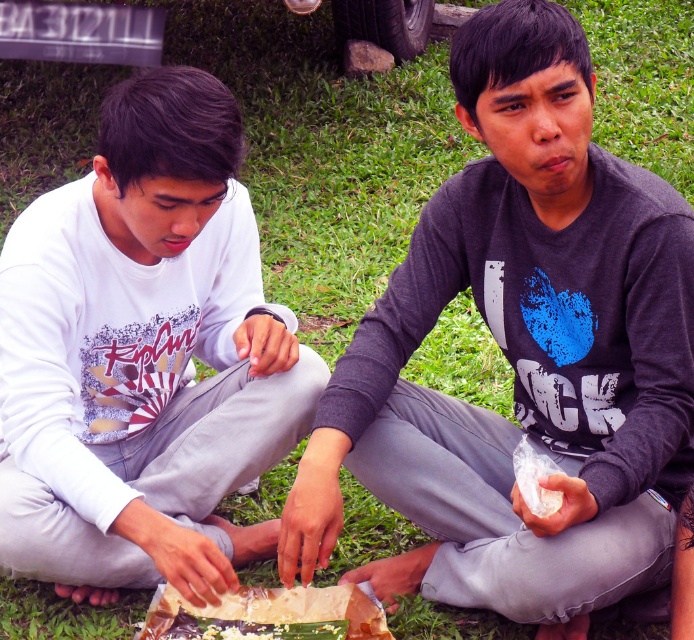
Does gray matte shirt at center appear on the right side of translucent plastic wrap at center?

Indeed, gray matte shirt at center is positioned on the right side of translucent plastic wrap at center.

Between point (310, 541) and point (321, 627), which one is positioned behind?

Positioned behind is point (321, 627).

Identify the location of gray matte shirt at center. The width and height of the screenshot is (694, 640). (520, 355).

Locate an element on the screen. This screenshot has height=640, width=694. gray matte shirt at center is located at coordinates (520, 355).

Is point (201, 404) behind point (347, 632)?

Yes.

Is white matte shirt at center above translucent plastic wrap at center?

Yes.

Between point (118, 381) and point (296, 636), which one is positioned behind?

Point (118, 381)

Where is `white matte shirt at center`? This screenshot has width=694, height=640. white matte shirt at center is located at coordinates (143, 356).

Is gray matte shirt at center positioned behind white matte shirt at center?

No, gray matte shirt at center is in front of white matte shirt at center.

Which is above, gray matte shirt at center or white matte shirt at center?

gray matte shirt at center is higher up.

Does point (561, 276) lie in front of point (185, 243)?

Yes, point (561, 276) is in front of point (185, 243).

Identify the location of gray matte shirt at center. (520, 355).